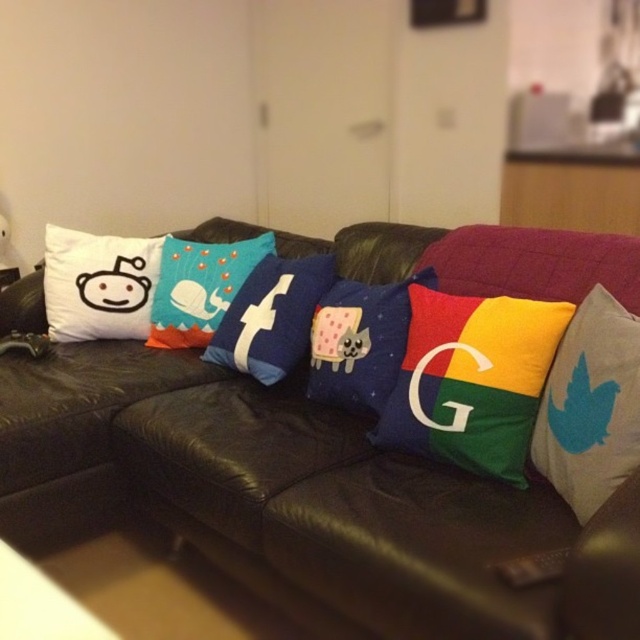
In the scene shown: You are a delivery person who needs to place a small package between the black leather couch at center and the white fabric twitter bird at right. The package is 16 inches long. Will it fit in the space between them?

The distance between the black leather couch at center and the white fabric twitter bird at right is 17.06 inches. Since the package is 16 inches long, it will fit in the space between them because 16 is less than 17.06.

You are a guest entering the living room and want to sit on the black leather couch at center. Which side of the couch should you approach to face the white fabric twitter bird at right?

You should approach the right side of the black leather couch at center because it is positioned to the left of the white fabric twitter bird at right, meaning the couch faces towards the right side of the room.